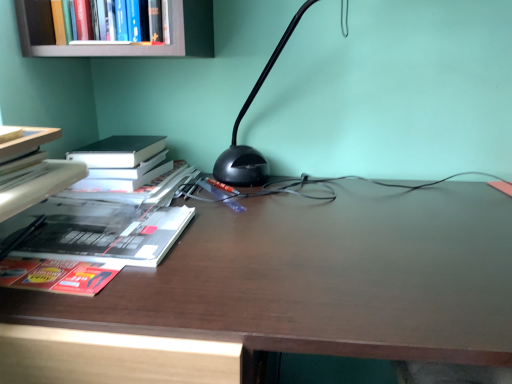
The width and height of the screenshot is (512, 384). Find the location of `free space in front of black plastic lamp at center`. free space in front of black plastic lamp at center is located at coordinates (315, 255).